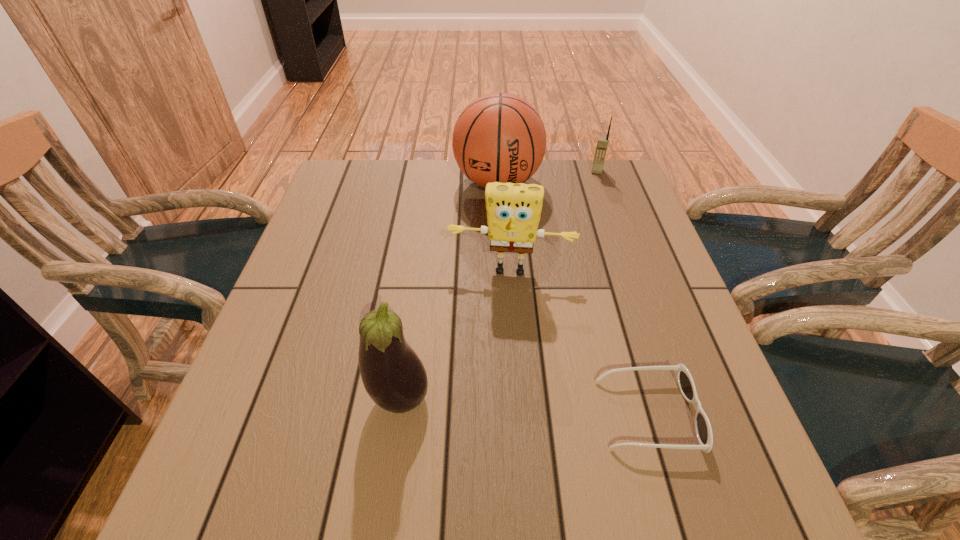
Locate an element on the screen. The height and width of the screenshot is (540, 960). vacant area that lies between the cellular telephone and the third nearest object is located at coordinates (554, 221).

This screenshot has width=960, height=540. Identify the location of vacant space that is in between the sponge and the leftmost object. (455, 334).

Where is `free point between the basketball and the shortest object`? The image size is (960, 540). free point between the basketball and the shortest object is located at coordinates (573, 298).

The height and width of the screenshot is (540, 960). I want to click on empty space between the cellular telephone and the sponge, so click(x=554, y=221).

Locate an element on the screen. The width and height of the screenshot is (960, 540). vacant space that's between the shortest object and the basketball is located at coordinates (573, 298).

Where is `vacant area that lies between the leftmost object and the basketball`? The width and height of the screenshot is (960, 540). vacant area that lies between the leftmost object and the basketball is located at coordinates (449, 290).

Where is `blank region between the second shortest object and the sponge`? This screenshot has height=540, width=960. blank region between the second shortest object and the sponge is located at coordinates (554, 221).

What are the coordinates of `free space that is in between the sunglasses and the second shortest object` in the screenshot? It's located at (622, 293).

Identify the location of vacant space that's between the sunglasses and the sponge. The image size is (960, 540). (579, 342).

Select which object appears as the fourth closest to the basketball. Please provide its 2D coordinates. Your answer should be formatted as a tuple, i.e. [(x, y)], where the tuple contains the x and y coordinates of a point satisfying the conditions above.

[(685, 382)]